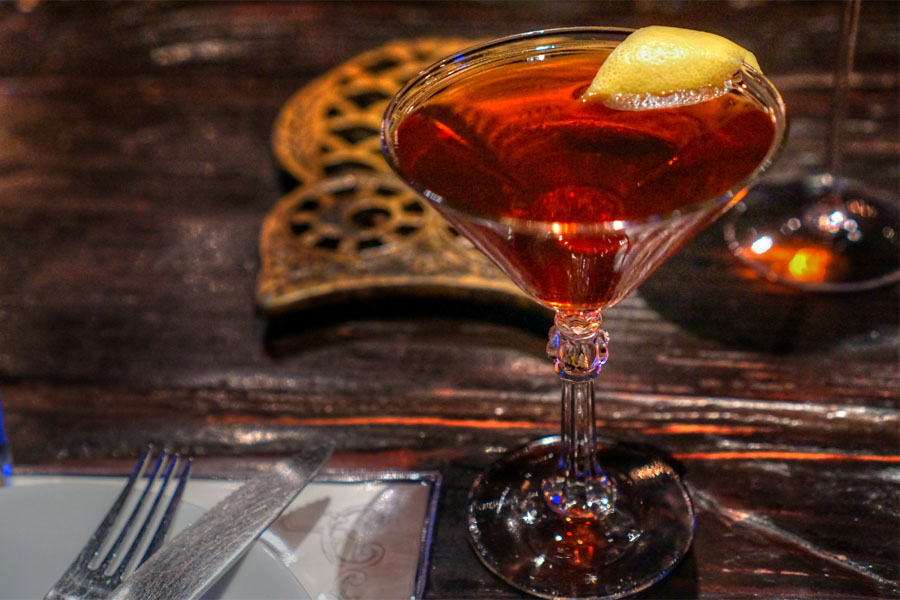
Where is `table`? The width and height of the screenshot is (900, 600). table is located at coordinates (117, 343).